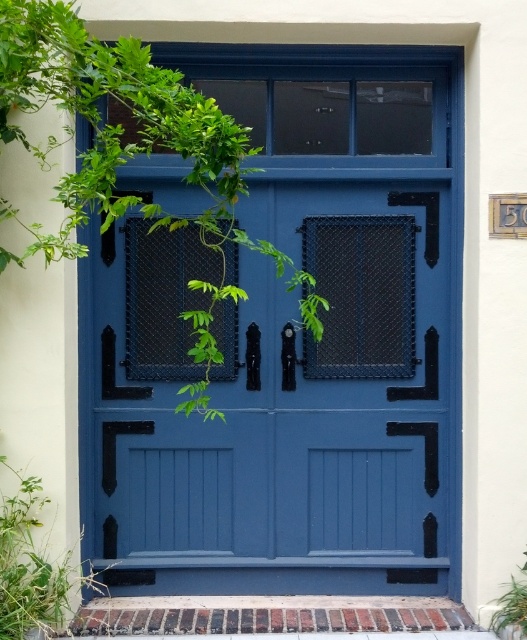
Is matte blue door at center in front of green leafy plant at lower left?

No.

Does point (450, 536) come farther from viewer compared to point (63, 561)?

Yes, point (450, 536) is behind point (63, 561).

The height and width of the screenshot is (640, 527). I want to click on matte blue door at center, so click(289, 342).

Does matte blue door at center have a greater width compared to green leafy plant at center?

Yes.

Between matte blue door at center and green leafy plant at center, which one has less height?

green leafy plant at center is shorter.

Is point (136, 404) farther from camera compared to point (492, 625)?

That is True.

You are a GUI agent. You are given a task and a screenshot of the screen. Output one action in this format:
    pyautogui.click(x=<x>, y=<y>)
    Task: Click on the matte blue door at center
    
    Given the screenshot: What is the action you would take?
    pyautogui.click(x=289, y=342)

Between point (14, 532) and point (519, 618), which one is positioned in front?

Point (519, 618) is more forward.

Between point (56, 589) and point (518, 609), which one is positioned behind?

The point (518, 609) is more distant.

The width and height of the screenshot is (527, 640). I want to click on green leafy plant at lower left, so click(32, 566).